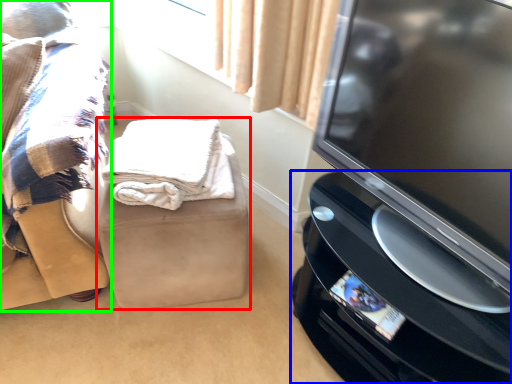
Question: Which object is positioned farthest from furniture (highlighted by a red box)? Select from home appliance (highlighted by a blue box) and furniture (highlighted by a green box).

Choices:
 (A) home appliance
 (B) furniture

Answer: (A)